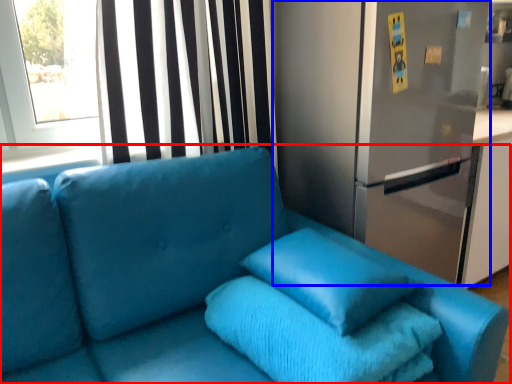
Question: Which object is closer to the camera taking this photo, studio couch (highlighted by a red box) or fridge (highlighted by a blue box)?

Choices:
 (A) studio couch
 (B) fridge

Answer: (A)